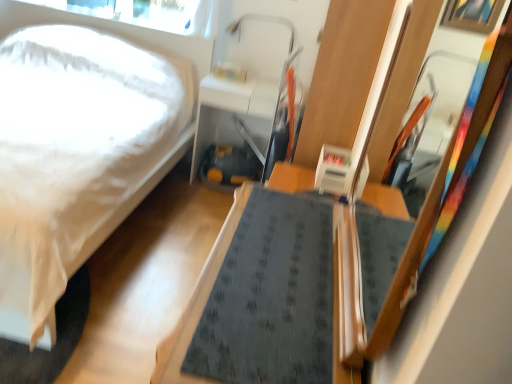
Question: Is transparent glass window screen at upper left thinner than dark gray fabric table at center, positioned as the second table in back-to-front order?

Choices:
 (A) no
 (B) yes

Answer: (B)

Question: Can you confirm if transparent glass window screen at upper left is shorter than dark gray fabric table at center, positioned as the second table in back-to-front order?

Choices:
 (A) no
 (B) yes

Answer: (B)

Question: Does transparent glass window screen at upper left have a smaller size compared to dark gray fabric table at center, positioned as the second table in back-to-front order?

Choices:
 (A) yes
 (B) no

Answer: (A)

Question: Can you confirm if transparent glass window screen at upper left is bigger than dark gray fabric table at center, which ranks as the second table in top-to-bottom order?

Choices:
 (A) no
 (B) yes

Answer: (A)

Question: From a real-world perspective, is transparent glass window screen at upper left on dark gray fabric table at center, which ranks as the 1th table in bottom-to-top order?

Choices:
 (A) no
 (B) yes

Answer: (B)

Question: Considering the relative sizes of transparent glass window screen at upper left and dark gray fabric table at center, which ranks as the second table in top-to-bottom order, in the image provided, is transparent glass window screen at upper left wider than dark gray fabric table at center, which ranks as the second table in top-to-bottom order,?

Choices:
 (A) yes
 (B) no

Answer: (B)

Question: Is transparent glass window screen at upper left outside matte white table at center, marked as the first table in a top-to-bottom arrangement?

Choices:
 (A) yes
 (B) no

Answer: (A)

Question: Considering the relative positions of transparent glass window screen at upper left and matte white table at center, marked as the first table in a top-to-bottom arrangement, in the image provided, is transparent glass window screen at upper left to the left of matte white table at center, marked as the first table in a top-to-bottom arrangement, from the viewer's perspective?

Choices:
 (A) yes
 (B) no

Answer: (A)

Question: Does transparent glass window screen at upper left have a greater width compared to matte white table at center, marked as the first table in a top-to-bottom arrangement?

Choices:
 (A) yes
 (B) no

Answer: (B)

Question: Considering the relative positions of transparent glass window screen at upper left and matte white table at center, the second table from the front, in the image provided, is transparent glass window screen at upper left in front of matte white table at center, the second table from the front,?

Choices:
 (A) yes
 (B) no

Answer: (B)

Question: From a real-world perspective, is transparent glass window screen at upper left located beneath matte white table at center, positioned as the first table in back-to-front order?

Choices:
 (A) no
 (B) yes

Answer: (A)

Question: Does transparent glass window screen at upper left have a lesser height compared to matte white table at center, positioned as the first table in back-to-front order?

Choices:
 (A) no
 (B) yes

Answer: (B)

Question: Does wooden framed mirror at right have a greater height compared to matte white table at center, the second table from the front?

Choices:
 (A) no
 (B) yes

Answer: (B)